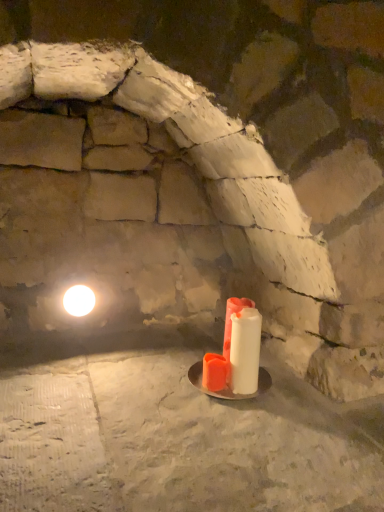
What do you see at coordinates (245, 351) in the screenshot? The width and height of the screenshot is (384, 512). I see `white matte candle at center` at bounding box center [245, 351].

The image size is (384, 512). Identify the location of white matte candle at center. (245, 351).

This screenshot has height=512, width=384. I want to click on white glossy light at upper left, so click(x=79, y=300).

Describe the element at coordinates (79, 300) in the screenshot. I see `white glossy light at upper left` at that location.

Image resolution: width=384 pixels, height=512 pixels. I want to click on white matte candle at center, so click(x=245, y=351).

Considering the relative positions of white glossy light at upper left and white matte candle at center in the image provided, is white glossy light at upper left to the right of white matte candle at center from the viewer's perspective?

No.

Is white glossy light at upper left in front of or behind white matte candle at center in the image?

white glossy light at upper left is behind white matte candle at center.

Considering the positions of points (65, 297) and (236, 385), is point (65, 297) farther from camera compared to point (236, 385)?

That is True.

From the image's perspective, which one is positioned higher, white glossy light at upper left or white matte candle at center?

white glossy light at upper left is shown above in the image.

From a real-world perspective, is white glossy light at upper left physically located above or below white matte candle at center?

white glossy light at upper left is above white matte candle at center.

Considering the sizes of white glossy light at upper left and white matte candle at center in the image, is white glossy light at upper left wider or thinner than white matte candle at center?

white glossy light at upper left is wider than white matte candle at center.

Who is taller, white glossy light at upper left or white matte candle at center?

With more height is white matte candle at center.

Is white glossy light at upper left bigger or smaller than white matte candle at center?

Considering their sizes, white glossy light at upper left takes up less space than white matte candle at center.

Is white glossy light at upper left not inside white matte candle at center?

Yes, white glossy light at upper left is located beyond the bounds of white matte candle at center.

Is the surface of white glossy light at upper left in direct contact with white matte candle at center?

No, white glossy light at upper left is not making contact with white matte candle at center.

Is white glossy light at upper left aimed at white matte candle at center?

No, white glossy light at upper left is not facing towards white matte candle at center.

How different are the orientations of white glossy light at upper left and white matte candle at center in degrees?

1.58 degrees.

I want to click on candle lying on the right of white glossy light at upper left, so click(245, 351).

Based on their positions, is white matte candle at center located to the left or right of white glossy light at upper left?

white matte candle at center is to the right of white glossy light at upper left.

Considering the positions of objects white matte candle at center and white glossy light at upper left in the image provided, who is behind, white matte candle at center or white glossy light at upper left?

Positioned behind is white glossy light at upper left.

Considering the positions of points (250, 376) and (75, 309), is point (250, 376) closer to camera compared to point (75, 309)?

Yes, it is.

In the scene shown: From the image's perspective, between white matte candle at center and white glossy light at upper left, which one is located above?

white glossy light at upper left.

From a real-world perspective, between white matte candle at center and white glossy light at upper left, who is vertically higher?

In real-world perspective, white glossy light at upper left is above.

Considering the relative sizes of white matte candle at center and white glossy light at upper left in the image provided, is white matte candle at center thinner than white glossy light at upper left?

Yes, white matte candle at center is thinner than white glossy light at upper left.

Which of these two, white matte candle at center or white glossy light at upper left, stands taller?

white matte candle at center.

Does white matte candle at center have a larger size compared to white glossy light at upper left?

Yes, white matte candle at center is bigger than white glossy light at upper left.

In the scene shown: Is white matte candle at center spatially inside white glossy light at upper left, or outside of it?

white matte candle at center is spatially situated outside white glossy light at upper left.

Is white matte candle at center beside white glossy light at upper left?

They are not placed beside each other.

In the scene shown: Is white matte candle at center facing towards white glossy light at upper left?

No, white matte candle at center is not aimed at white glossy light at upper left.

What's the angular difference between white matte candle at center and white glossy light at upper left's facing directions?

There is a 1.58-degree angle between the facing directions of white matte candle at center and white glossy light at upper left.

How much distance is there between white matte candle at center and white glossy light at upper left?

white matte candle at center and white glossy light at upper left are 29.36 inches apart.

The width and height of the screenshot is (384, 512). What are the coordinates of `candle on the right of white glossy light at upper left` in the screenshot? It's located at (245, 351).

Image resolution: width=384 pixels, height=512 pixels. I want to click on candle that appears in front of the white glossy light at upper left, so click(x=245, y=351).

What are the coordinates of `light that appears on the left of white matte candle at center` in the screenshot? It's located at (79, 300).